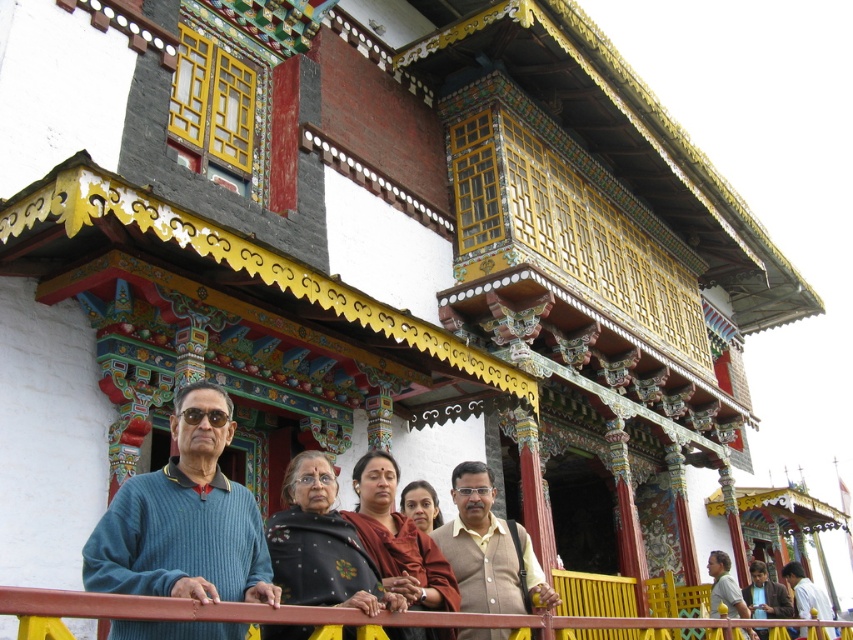
Is brown leather jacket at center further to the viewer compared to light brown fabric shirt at center?

Yes, brown leather jacket at center is further from the viewer.

Does point (759, 573) come closer to viewer compared to point (810, 602)?

No, it is not.

Locate an element on the screen. The height and width of the screenshot is (640, 853). brown leather jacket at center is located at coordinates (764, 595).

Who is more forward, [532,616] or [790,563]?

Point [532,616] is in front.

Does metallic red railing at lower center appear over light brown fabric shirt at center?

Yes.

Measure the distance between metallic red railing at lower center and camera.

They are 20.62 meters apart.

Locate an element on the screen. Image resolution: width=853 pixels, height=640 pixels. metallic red railing at lower center is located at coordinates (323, 612).

Which is below, brown textured sweater at center or light brown fabric shirt at center?

light brown fabric shirt at center

Where is `brown textured sweater at center`? brown textured sweater at center is located at coordinates (488, 548).